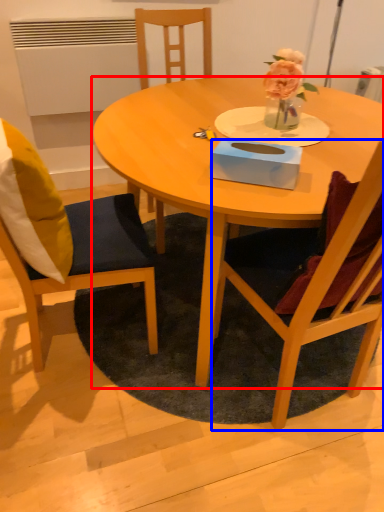
Question: Which object appears farthest to the camera in this image, coffee table (highlighted by a red box) or chair (highlighted by a blue box)?

Choices:
 (A) coffee table
 (B) chair

Answer: (A)